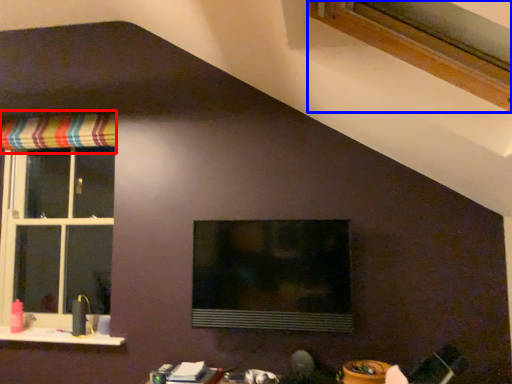
Question: Which object appears closest to the camera in this image, curtain (highlighted by a red box) or window (highlighted by a blue box)?

Choices:
 (A) curtain
 (B) window

Answer: (B)